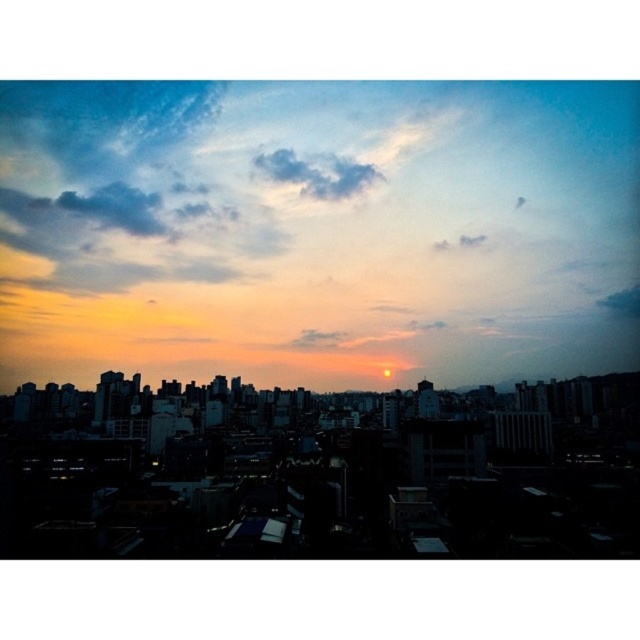
Question: Observing the image, what is the correct spatial positioning of cloudy sky at center in reference to cloudy sky at upper center?

Choices:
 (A) above
 (B) below

Answer: (B)

Question: Which point is closer to the camera?

Choices:
 (A) (362, 186)
 (B) (211, 113)

Answer: (A)

Question: Which point is farther to the camera?

Choices:
 (A) cloudy sky at center
 (B) cloudy sky at upper center

Answer: (B)

Question: Can you confirm if cloudy sky at center is positioned below cloudy sky at upper center?

Choices:
 (A) yes
 (B) no

Answer: (A)

Question: Does cloudy sky at center lie behind cloudy sky at upper center?

Choices:
 (A) no
 (B) yes

Answer: (A)